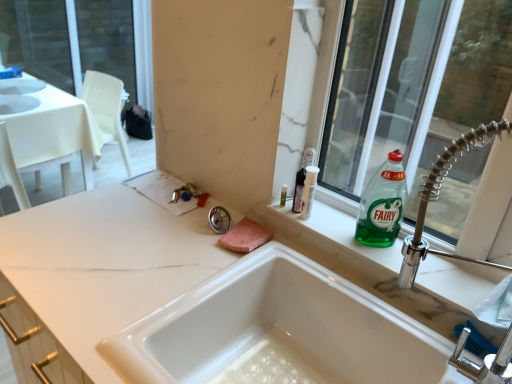
Question: Considering the relative sizes of transparent glass window at upper right and green glass bottle at upper right in the image provided, is transparent glass window at upper right smaller than green glass bottle at upper right?

Choices:
 (A) yes
 (B) no

Answer: (B)

Question: Does transparent glass window at upper right come behind green glass bottle at upper right?

Choices:
 (A) no
 (B) yes

Answer: (A)

Question: Considering the relative sizes of transparent glass window at upper right and green glass bottle at upper right in the image provided, is transparent glass window at upper right shorter than green glass bottle at upper right?

Choices:
 (A) no
 (B) yes

Answer: (A)

Question: Is transparent glass window at upper right in contact with green glass bottle at upper right?

Choices:
 (A) no
 (B) yes

Answer: (A)

Question: Can you confirm if transparent glass window at upper right is bigger than green glass bottle at upper right?

Choices:
 (A) yes
 (B) no

Answer: (A)

Question: Relative to translucent plastic bottle at upper right, is white marble countertop at center in front or behind?

Choices:
 (A) front
 (B) behind

Answer: (A)

Question: From the image's perspective, is white marble countertop at center above or below translucent plastic bottle at upper right?

Choices:
 (A) above
 (B) below

Answer: (B)

Question: Looking at the image, does white marble countertop at center seem bigger or smaller compared to translucent plastic bottle at upper right?

Choices:
 (A) big
 (B) small

Answer: (A)

Question: Is white marble countertop at center wider or thinner than translucent plastic bottle at upper right?

Choices:
 (A) thin
 (B) wide

Answer: (B)

Question: Considering the positions of green glass bottle at upper right and white glossy sink at upper left in the image, is green glass bottle at upper right wider or thinner than white glossy sink at upper left?

Choices:
 (A) thin
 (B) wide

Answer: (A)

Question: In the image, is green glass bottle at upper right positioned in front of or behind white glossy sink at upper left?

Choices:
 (A) front
 (B) behind

Answer: (A)

Question: From the image's perspective, relative to white glossy sink at upper left, is green glass bottle at upper right above or below?

Choices:
 (A) above
 (B) below

Answer: (B)

Question: Is green glass bottle at upper right bigger or smaller than white glossy sink at upper left?

Choices:
 (A) big
 (B) small

Answer: (B)

Question: Considering the positions of transparent glass window at upper right and white glossy sink at center in the image, is transparent glass window at upper right bigger or smaller than white glossy sink at center?

Choices:
 (A) big
 (B) small

Answer: (B)

Question: Considering their positions, is transparent glass window at upper right located in front of or behind white glossy sink at center?

Choices:
 (A) behind
 (B) front

Answer: (A)